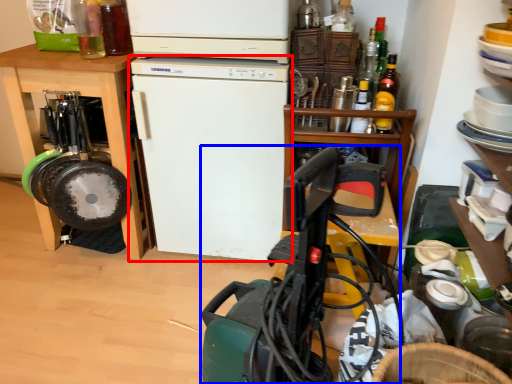
Question: Which object appears farthest to the camera in this image, refrigerator (highlighted by a red box) or appliance (highlighted by a blue box)?

Choices:
 (A) refrigerator
 (B) appliance

Answer: (A)